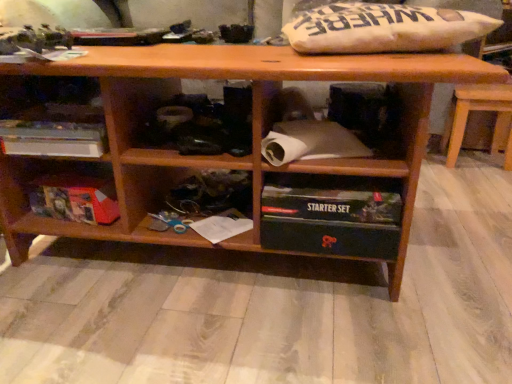
Locate an element on the screen. Image resolution: width=512 pixels, height=384 pixels. black plastic starter set at lower center, the 1th shelf viewed from the right is located at coordinates (332, 215).

From the image's perspective, is black plastic starter set at lower center, which ranks as the 3th shelf in left-to-right order, located beneath brown wooden table at right?

Yes, from the image's perspective, black plastic starter set at lower center, which ranks as the 3th shelf in left-to-right order, is below brown wooden table at right.

Which is behind, point (346, 224) or point (463, 100)?

The point (463, 100) is more distant.

Between black plastic starter set at lower center, which ranks as the 3th shelf in left-to-right order, and brown wooden table at right, which one appears on the right side from the viewer's perspective?

From the viewer's perspective, brown wooden table at right appears more on the right side.

Who is more distant, black plastic starter set at lower center, which ranks as the 3th shelf in left-to-right order, or brown wooden table at right?

brown wooden table at right is behind.

Is matte cardboard box at lower left, positioned as the 1th shelf in left-to-right order, directly adjacent to white paper at lower center?

No, matte cardboard box at lower left, positioned as the 1th shelf in left-to-right order, is not with white paper at lower center.

Considering the points (57, 215) and (236, 235), which point is behind, point (57, 215) or point (236, 235)?

The point (57, 215) is farther.

Looking at this image, is the position of matte cardboard box at lower left, positioned as the 1th shelf in left-to-right order, less distant than that of white paper at lower center?

No, the depth of matte cardboard box at lower left, positioned as the 1th shelf in left-to-right order, is greater than that of white paper at lower center.

What's the angular difference between matte cardboard box at lower left, acting as the 3th shelf starting from the right, and white paper at lower center's facing directions?

38.8 degrees.

Is point (450, 136) positioned after point (94, 104)?

Yes.

Considering the sizes of objects brown wooden table at right and white cardboard box at left, placed as the second shelf when sorted from right to left, in the image provided, who is bigger, brown wooden table at right or white cardboard box at left, placed as the second shelf when sorted from right to left,?

Bigger between the two is brown wooden table at right.

How different are the orientations of brown wooden table at right and white cardboard box at left, the second shelf viewed from the left, in degrees?

There is a 0.00155-degree angle between the facing directions of brown wooden table at right and white cardboard box at left, the second shelf viewed from the left.

From the brown wooden table at right, count 2nd shelfs forward and point to it. Please provide its 2D coordinates.

[(52, 117)]

Is black plastic starter set at lower center, which ranks as the 3th shelf in left-to-right order, not inside white cardboard box at left, placed as the second shelf when sorted from right to left?

Yes.

From a real-world perspective, which is physically below, black plastic starter set at lower center, the 1th shelf viewed from the right, or white cardboard box at left, the second shelf viewed from the left?

black plastic starter set at lower center, the 1th shelf viewed from the right, is physically lower.

Can you tell me how much black plastic starter set at lower center, the 1th shelf viewed from the right, and white cardboard box at left, placed as the second shelf when sorted from right to left, differ in facing direction?

They differ by 0.00104 degrees in their facing directions.

How distant is black plastic starter set at lower center, which ranks as the 3th shelf in left-to-right order, from white cardboard box at left, placed as the second shelf when sorted from right to left?

A distance of 53.80 centimeters exists between black plastic starter set at lower center, which ranks as the 3th shelf in left-to-right order, and white cardboard box at left, placed as the second shelf when sorted from right to left.

From a real-world perspective, is black plastic starter set at lower center, which ranks as the 3th shelf in left-to-right order, under white paper at lower center?

No, from a real-world perspective, black plastic starter set at lower center, which ranks as the 3th shelf in left-to-right order, is not beneath white paper at lower center.

Which object is closer to the camera taking this photo, black plastic starter set at lower center, the 1th shelf viewed from the right, or white paper at lower center?

black plastic starter set at lower center, the 1th shelf viewed from the right, is closer to the camera.

Visually, is black plastic starter set at lower center, the 1th shelf viewed from the right, positioned to the left or to the right of white paper at lower center?

In the image, black plastic starter set at lower center, the 1th shelf viewed from the right, appears on the right side of white paper at lower center.

Is black plastic starter set at lower center, which ranks as the 3th shelf in left-to-right order, facing away from white paper at lower center?

No, black plastic starter set at lower center, which ranks as the 3th shelf in left-to-right order, is not facing the opposite direction of white paper at lower center.

Is matte cardboard box at lower left, positioned as the 1th shelf in left-to-right order, looking in the opposite direction of white cardboard box at left, the second shelf viewed from the left?

That's not correct — matte cardboard box at lower left, positioned as the 1th shelf in left-to-right order, is not looking away from white cardboard box at left, the second shelf viewed from the left.

Is matte cardboard box at lower left, positioned as the 1th shelf in left-to-right order, touching white cardboard box at left, placed as the second shelf when sorted from right to left?

No, matte cardboard box at lower left, positioned as the 1th shelf in left-to-right order, is not beside white cardboard box at left, placed as the second shelf when sorted from right to left.

From the image's perspective, is matte cardboard box at lower left, positioned as the 1th shelf in left-to-right order, located above or below white cardboard box at left, placed as the second shelf when sorted from right to left?

Clearly, from the image's perspective, matte cardboard box at lower left, positioned as the 1th shelf in left-to-right order, is below white cardboard box at left, placed as the second shelf when sorted from right to left.

Can you confirm if matte cardboard box at lower left, positioned as the 1th shelf in left-to-right order, is thinner than white cardboard box at left, placed as the second shelf when sorted from right to left?

Yes.

Is white paper at lower center next to brown wooden table at right?

No.

Relative to brown wooden table at right, is white paper at lower center in front or behind?

Clearly, white paper at lower center is in front of brown wooden table at right.

The height and width of the screenshot is (384, 512). Find the location of `table above the white paper at lower center (from a real-world perspective)`. table above the white paper at lower center (from a real-world perspective) is located at coordinates (478, 110).

How many degrees apart are the facing directions of white paper at lower center and brown wooden table at right?

38.8 degrees.

The height and width of the screenshot is (384, 512). There is a brown wooden table at right. In order to click on the 3rd shelf below it (from the image's perspective) in this screenshot , I will do `click(332, 215)`.

In order to click on the 2nd shelf to the left of the white paper at lower center, starting your count from the anchor in this screenshot , I will do `click(67, 190)`.

Looking at this image, based on their spatial positions, is brown wooden table at right or black plastic starter set at lower center, which ranks as the 3th shelf in left-to-right order, further from matte cardboard box at lower left, acting as the 3th shelf starting from the right?

Among the two, brown wooden table at right is located further to matte cardboard box at lower left, acting as the 3th shelf starting from the right.

When comparing their distances from black plastic starter set at lower center, the 1th shelf viewed from the right, does matte cardboard box at lower left, positioned as the 1th shelf in left-to-right order, or white cardboard box at left, placed as the second shelf when sorted from right to left, seem further?

Based on the image, white cardboard box at left, placed as the second shelf when sorted from right to left, appears to be further to black plastic starter set at lower center, the 1th shelf viewed from the right.

Estimate the real-world distances between objects in this image. Which object is closer to matte cardboard box at lower left, acting as the 3th shelf starting from the right, brown wooden table at right or white cardboard box at left, the second shelf viewed from the left?

The object closer to matte cardboard box at lower left, acting as the 3th shelf starting from the right, is white cardboard box at left, the second shelf viewed from the left.

When comparing their distances from matte cardboard box at lower left, acting as the 3th shelf starting from the right, does white cardboard box at left, the second shelf viewed from the left, or black plastic starter set at lower center, which ranks as the 3th shelf in left-to-right order, seem closer?

The object closer to matte cardboard box at lower left, acting as the 3th shelf starting from the right, is white cardboard box at left, the second shelf viewed from the left.

Considering their positions, is brown wooden table at right positioned further to white cardboard box at left, the second shelf viewed from the left, than black plastic starter set at lower center, the 1th shelf viewed from the right?

Based on the image, brown wooden table at right appears to be further to white cardboard box at left, the second shelf viewed from the left.

Considering their positions, is black plastic starter set at lower center, the 1th shelf viewed from the right, positioned further to brown wooden table at right than white cardboard box at left, placed as the second shelf when sorted from right to left?

white cardboard box at left, placed as the second shelf when sorted from right to left, is further to brown wooden table at right.

Considering their positions, is white paper at lower center positioned further to black plastic starter set at lower center, the 1th shelf viewed from the right, than matte cardboard box at lower left, acting as the 3th shelf starting from the right?

Based on the image, matte cardboard box at lower left, acting as the 3th shelf starting from the right, appears to be further to black plastic starter set at lower center, the 1th shelf viewed from the right.

Based on their spatial positions, is white paper at lower center or brown wooden table at right closer to matte cardboard box at lower left, positioned as the 1th shelf in left-to-right order?

Among the two, white paper at lower center is located nearer to matte cardboard box at lower left, positioned as the 1th shelf in left-to-right order.

Locate an element on the screen. book between white cardboard box at left, placed as the second shelf when sorted from right to left, and brown wooden table at right is located at coordinates (222, 226).

Where is `book between white cardboard box at left, placed as the second shelf when sorted from right to left, and black plastic starter set at lower center, the 1th shelf viewed from the right, in the horizontal direction`? The height and width of the screenshot is (384, 512). book between white cardboard box at left, placed as the second shelf when sorted from right to left, and black plastic starter set at lower center, the 1th shelf viewed from the right, in the horizontal direction is located at coordinates point(222,226).

Where is `shelf between matte cardboard box at lower left, acting as the 3th shelf starting from the right, and white paper at lower center`? shelf between matte cardboard box at lower left, acting as the 3th shelf starting from the right, and white paper at lower center is located at coordinates (52, 117).

I want to click on shelf situated between white paper at lower center and brown wooden table at right from left to right, so click(332, 215).